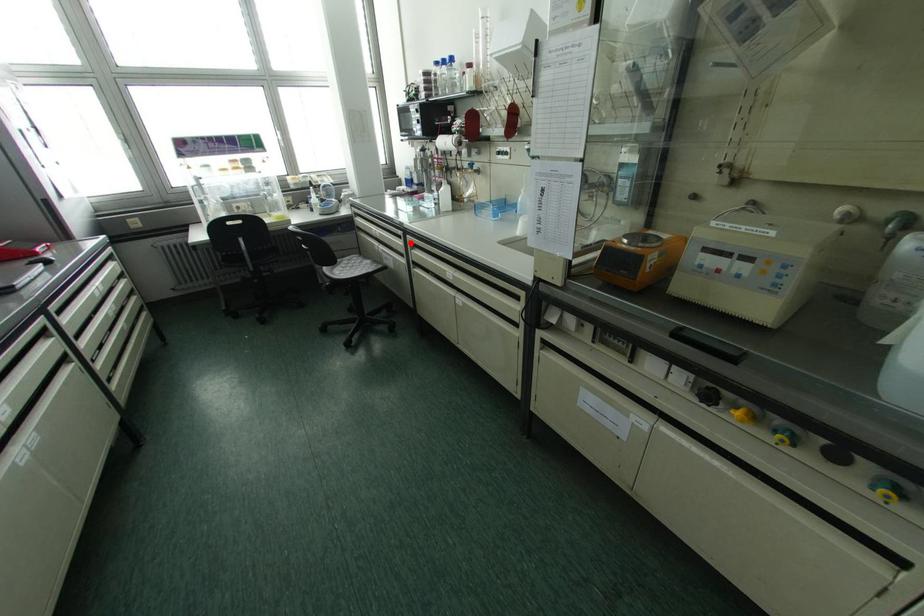
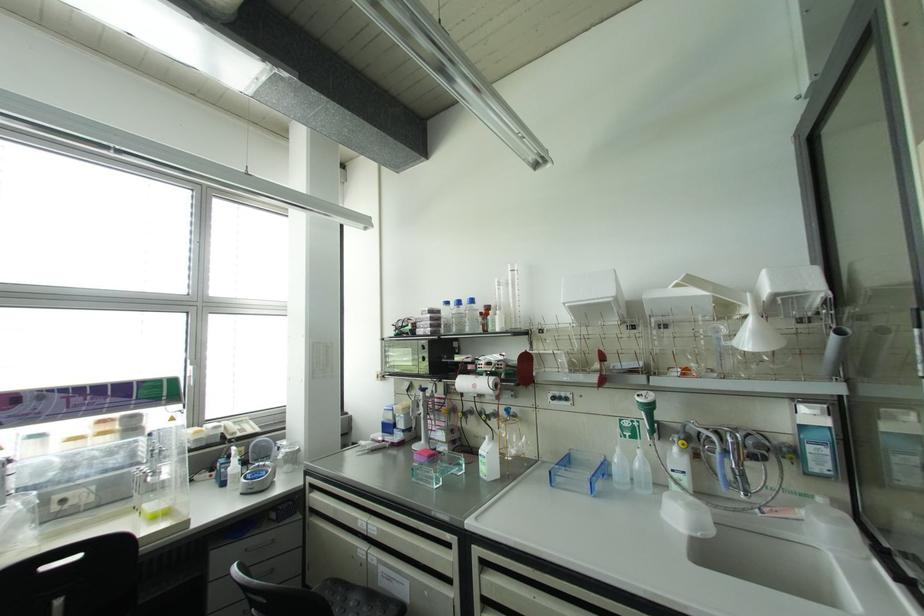
The point at the highlighted location is marked in the first image. Where is the corresponding point in the second image?

(482, 562)